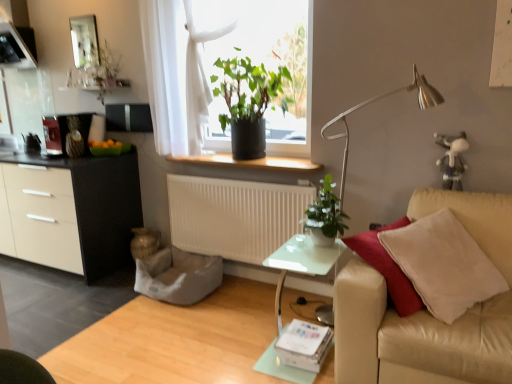
Where is `vacant region under green matte plant at center, arranged as the 1th houseplant when viewed from the front (from a real-world perspective)`? vacant region under green matte plant at center, arranged as the 1th houseplant when viewed from the front (from a real-world perspective) is located at coordinates (322, 247).